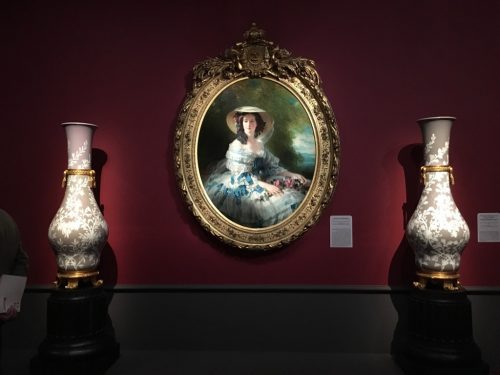
Where is `base of the vase`? The image size is (500, 375). base of the vase is located at coordinates (443, 276), (78, 274).